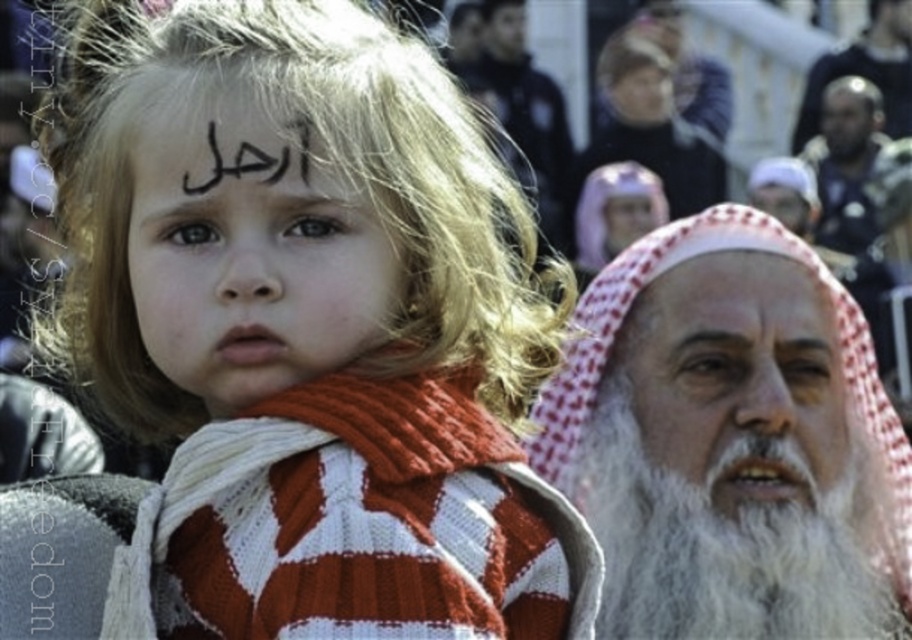
Question: Is matte black face at center above white beard at right?

Choices:
 (A) yes
 (B) no

Answer: (A)

Question: From the image, what is the correct spatial relationship of matte black face at center in relation to brown hair at upper center?

Choices:
 (A) left
 (B) right

Answer: (A)

Question: Which object is closer to the camera taking this photo?

Choices:
 (A) matte black face at center
 (B) white checkered headscarf at right
 (C) black hair at upper left

Answer: (A)

Question: Which point appears farthest from the camera in this image?

Choices:
 (A) (293, 125)
 (B) (741, 337)

Answer: (B)

Question: Which point appears farthest from the camera in this image?

Choices:
 (A) (810, 458)
 (B) (306, 177)
 (C) (228, 241)

Answer: (A)

Question: Can you confirm if knitted wool scarf at center is wider than gray hair at upper center?

Choices:
 (A) no
 (B) yes

Answer: (B)